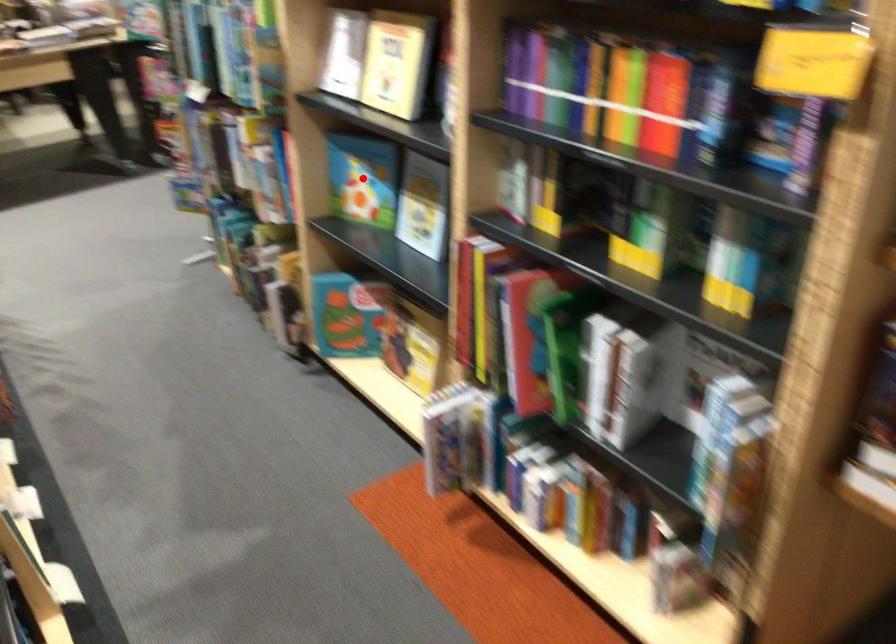
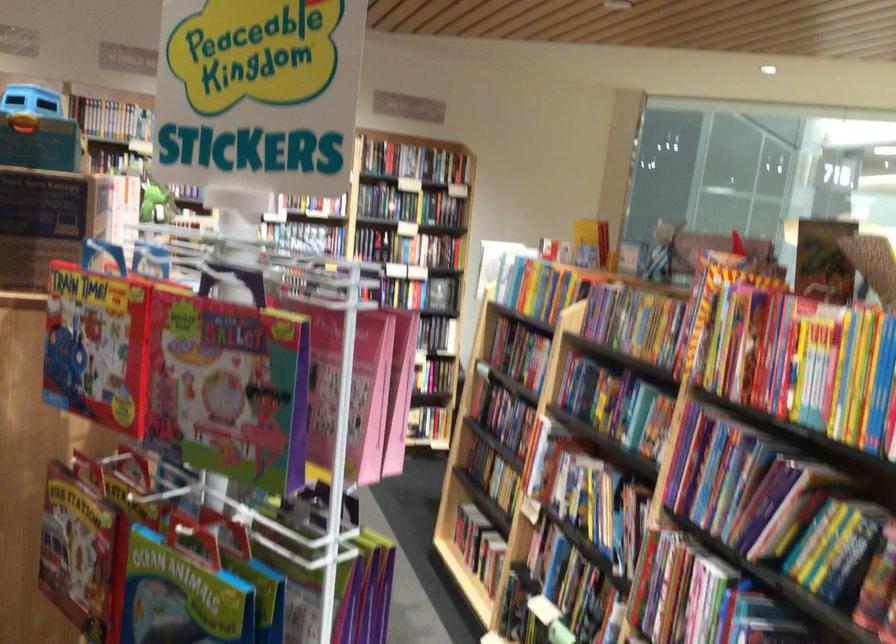
Question: I am providing you with two images of the same scene from different viewpoints. A red point is marked on the first image. Is the red point's position out of view in image 2?

Choices:
 (A) Yes
 (B) No

Answer: (A)